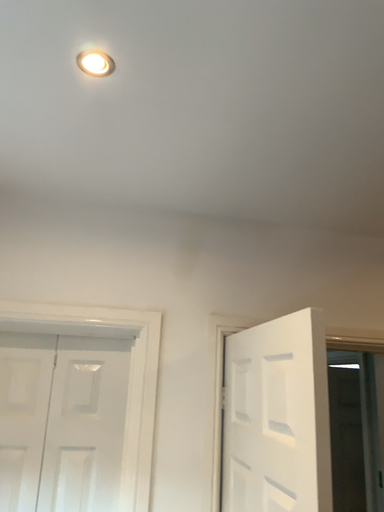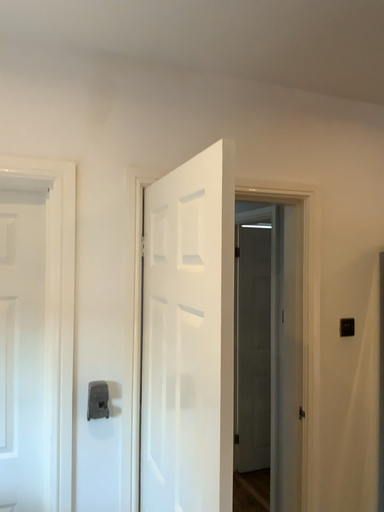
Question: How did the camera likely rotate when shooting the video?

Choices:
 (A) rotated right
 (B) rotated left

Answer: (A)